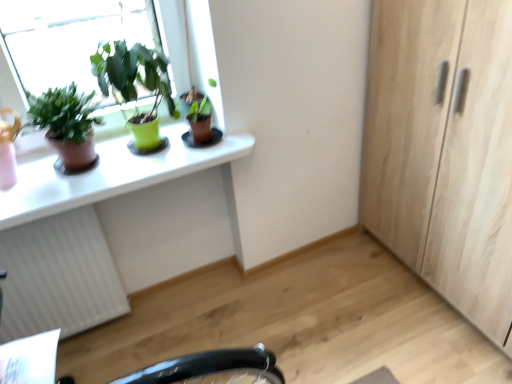
This screenshot has width=512, height=384. I want to click on vacant space underneath green matte pot at upper left, which is counted as the 2th houseplant, starting from the left (from a real-world perspective), so click(x=146, y=151).